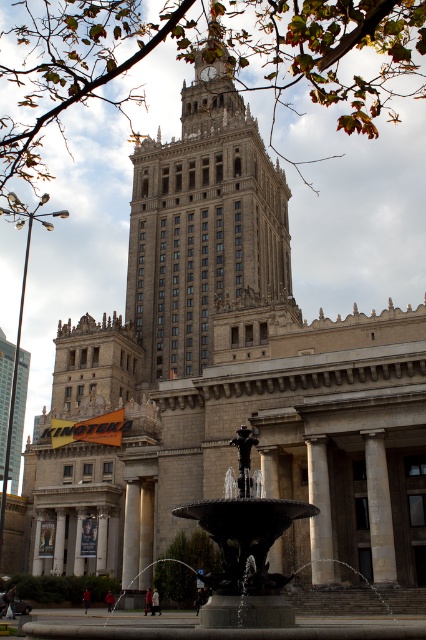
Who is more forward, (233, 161) or (365, 456)?

Point (365, 456)

Does beige stone tower at center appear under gray stone column at center?

Incorrect, beige stone tower at center is not positioned below gray stone column at center.

Which is in front, point (149, 355) or point (388, 532)?

Point (388, 532)

This screenshot has height=640, width=426. Find the location of `beige stone tower at center`. beige stone tower at center is located at coordinates (203, 225).

Image resolution: width=426 pixels, height=640 pixels. What do you see at coordinates (241, 579) in the screenshot? I see `bronze metallic fountain at center` at bounding box center [241, 579].

Is point (216, 525) positioned before point (377, 488)?

That is True.

Locate an element on the screen. The height and width of the screenshot is (640, 426). bronze metallic fountain at center is located at coordinates (241, 579).

Is beige stone tower at center thinner than bronze metallic fountain at center?

In fact, beige stone tower at center might be wider than bronze metallic fountain at center.

From the picture: Which is above, beige stone tower at center or bronze metallic fountain at center?

beige stone tower at center is above.

Locate an element on the screen. Image resolution: width=426 pixels, height=640 pixels. beige stone tower at center is located at coordinates tap(203, 225).